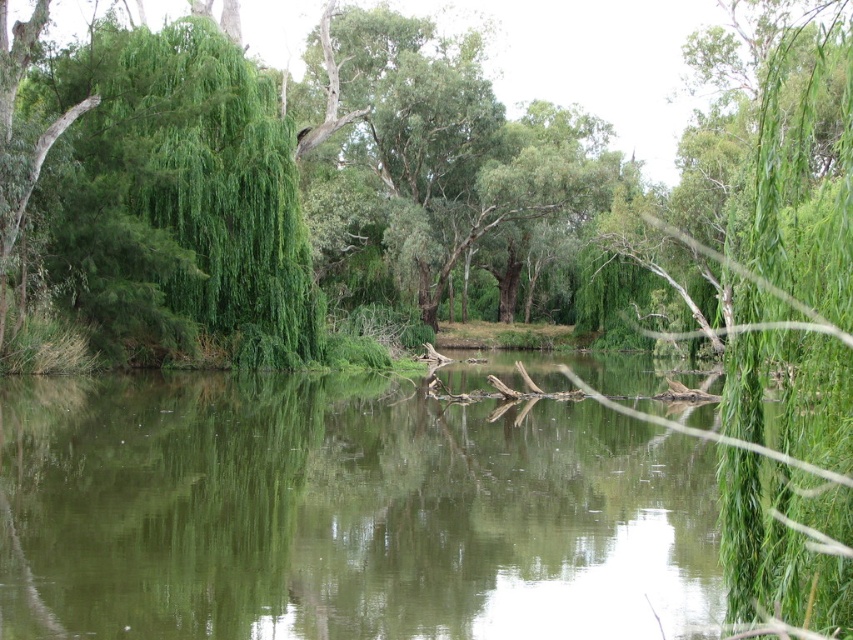
You are a bird looking for a nesting spot. You see the green leafy tree at center and the green leafy willow at left. Which tree would provide a larger area for building a nest?

The green leafy tree at center is larger in size than the green leafy willow at left, so it would provide a larger area for building a nest.

You are standing at the edge of the water and want to see the reflection of the green leafy willow at left. Can you see its reflection in the green reflective water at center?

The green reflective water at center is in front of the green leafy willow at left, so the reflection of the green leafy willow at left would be visible in the green reflective water at center since the water is positioned to reflect the willow.